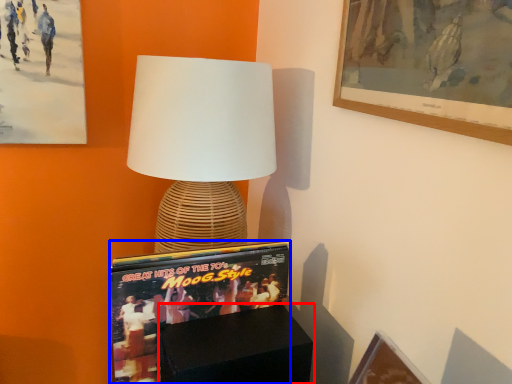
Question: Among these objects, which one is nearest to the camera, furniture (highlighted by a red box) or magazine (highlighted by a blue box)?

Choices:
 (A) furniture
 (B) magazine

Answer: (A)